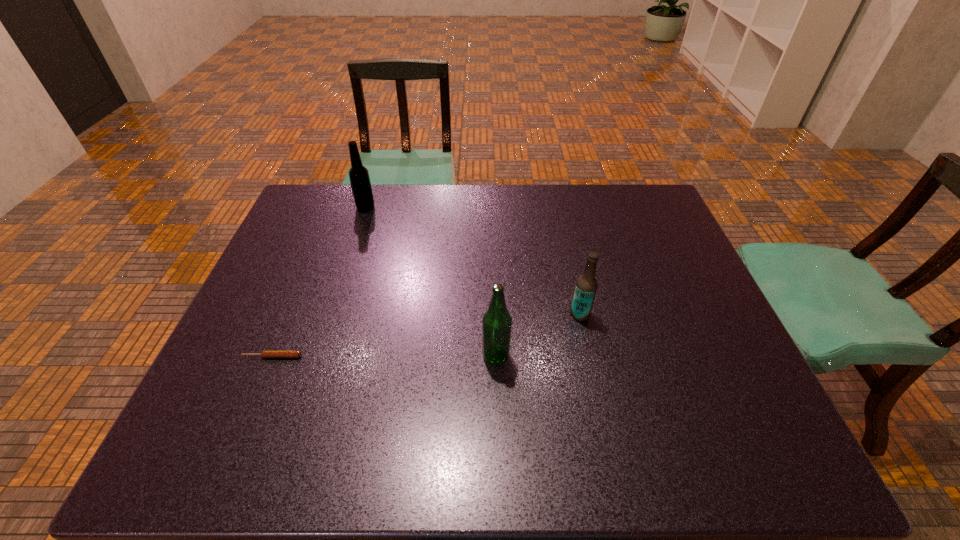
Find the location of `vacant region located 0.310m on the label of the nearest beer bottle`. vacant region located 0.310m on the label of the nearest beer bottle is located at coordinates (349, 356).

Image resolution: width=960 pixels, height=540 pixels. What are the coordinates of `free region located 0.150m on the label of the nearest beer bottle` in the screenshot? It's located at (419, 356).

The height and width of the screenshot is (540, 960). Identify the location of vacant space located on the label of the third nearest object. tap(421, 314).

Locate an element on the screen. vacant area located on the label of the third nearest object is located at coordinates (442, 314).

The width and height of the screenshot is (960, 540). I want to click on vacant position located 0.370m on the label of the third nearest object, so click(425, 314).

Find the location of a particular element. This screenshot has height=540, width=960. vacant space located on the right of the leftmost object is located at coordinates (392, 356).

Find the location of a particular element. This screenshot has height=540, width=960. object present at the far edge is located at coordinates (360, 182).

I want to click on object located at the left edge, so click(266, 353).

Identify the location of vacant space at the far edge of the desktop. The height and width of the screenshot is (540, 960). (600, 193).

Identify the location of vacant space at the near edge of the desktop. The width and height of the screenshot is (960, 540). (606, 447).